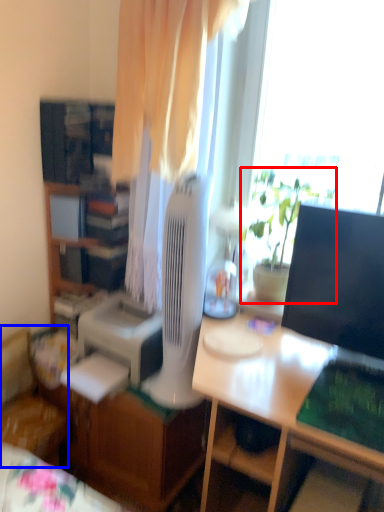
Question: Which of the following is the closest to the observer, houseplant (highlighted by a red box) or chair (highlighted by a blue box)?

Choices:
 (A) houseplant
 (B) chair

Answer: (A)